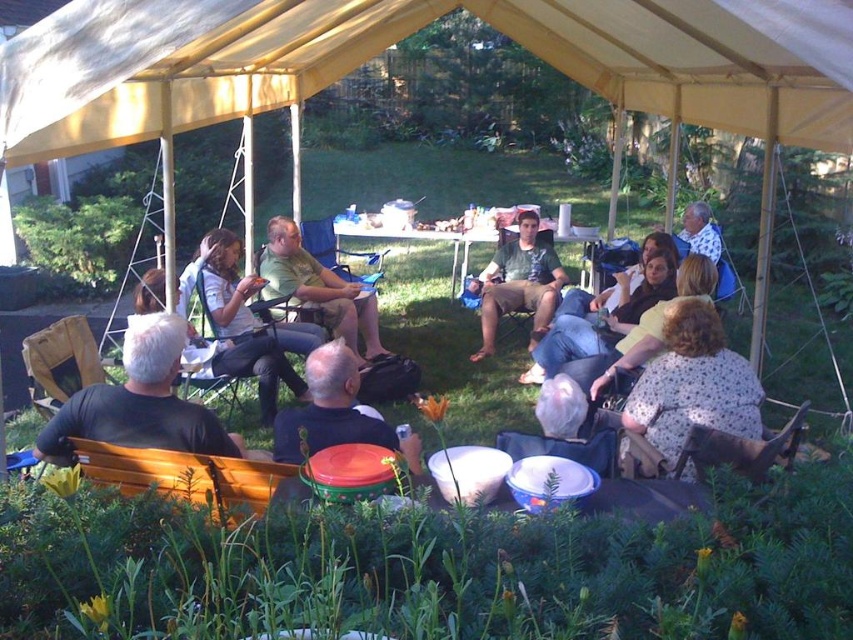
Question: Is yellow fabric tent at center above wooden folding chair at center?

Choices:
 (A) yes
 (B) no

Answer: (A)

Question: Which object appears farthest from the camera in this image?

Choices:
 (A) matte green t-shirt at center
 (B) white dotted shirt at upper right

Answer: (B)

Question: Can you confirm if black fabric chair at left is positioned to the left of white dotted shirt at upper right?

Choices:
 (A) no
 (B) yes

Answer: (B)

Question: Considering the real-world distances, which object is closest to the wooden folding chair at center?

Choices:
 (A) yellow fabric tent at center
 (B) matte white shirt at center
 (C) black fabric chair at left
 (D) green matte shirt at center

Answer: (D)

Question: Which of the following is the farthest from the observer?

Choices:
 (A) (563, 320)
 (B) (305, 1)

Answer: (A)

Question: Is light brown fabric dress at center to the left of matte green t-shirt at center from the viewer's perspective?

Choices:
 (A) yes
 (B) no

Answer: (B)